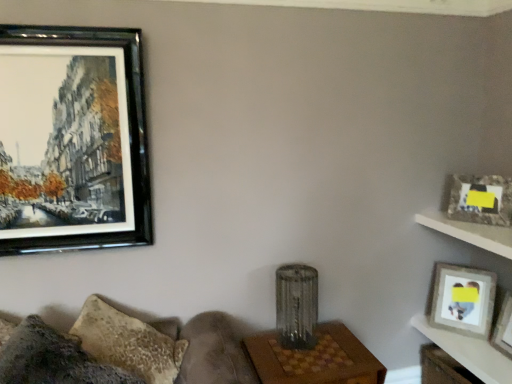
This screenshot has height=384, width=512. Identify the location of free space above wooden table at center, which is the 2th table from right to left (from a real-world perspective). (306, 356).